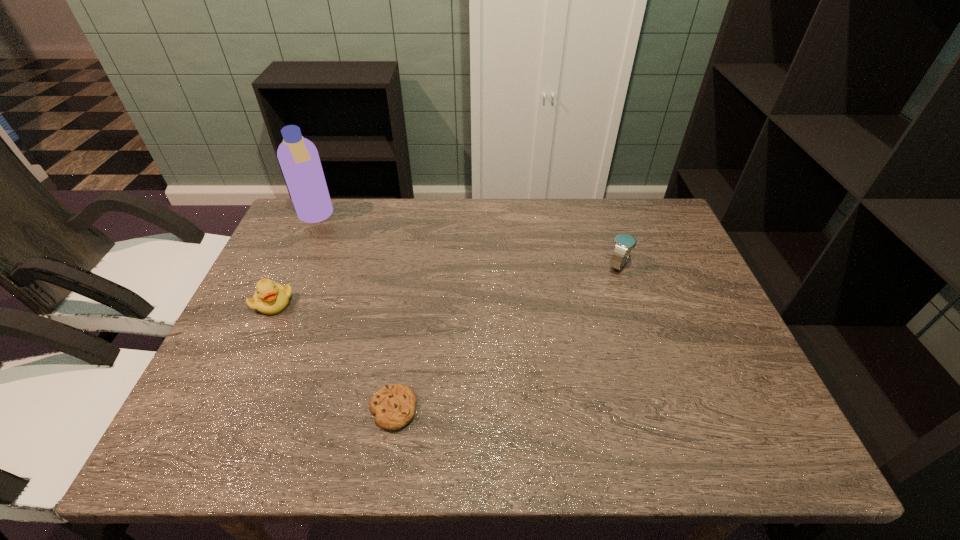
This screenshot has height=540, width=960. I want to click on shampoo, so click(298, 157).

Where is `the farthest object`? The image size is (960, 540). the farthest object is located at coordinates (298, 157).

Where is `watch`? watch is located at coordinates (624, 243).

Image resolution: width=960 pixels, height=540 pixels. I want to click on the second farthest object, so click(x=624, y=243).

Identify the location of duckling. (270, 298).

Where is `the shortest object`? Image resolution: width=960 pixels, height=540 pixels. the shortest object is located at coordinates (x=394, y=405).

At what (x,y) coordinates should I click in order to perform the action: click on cookie. Please return your answer as a coordinate pair (x, y). Looking at the image, I should click on (394, 405).

Locate an element on the screen. Image resolution: width=960 pixels, height=540 pixels. blank space located 0.200m on the front of the shampoo is located at coordinates (289, 275).

Identify the location of free space located on the back of the third nearest object. The image size is (960, 540). (612, 243).

You are a GUI agent. You are given a task and a screenshot of the screen. Output one action in this format:
    pyautogui.click(x=<x>, y=<y>)
    Task: Click on the free space located 0.170m on the beak of the duckling
    The width and height of the screenshot is (960, 540).
    Given the screenshot: What is the action you would take?
    240,375